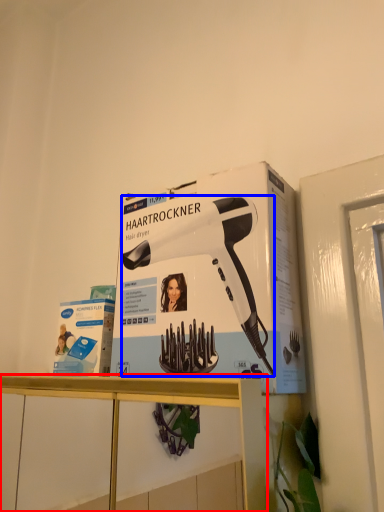
Question: Which point is further to the camera, furniture (highlighted by a red box) or hair drier (highlighted by a blue box)?

Choices:
 (A) furniture
 (B) hair drier

Answer: (B)